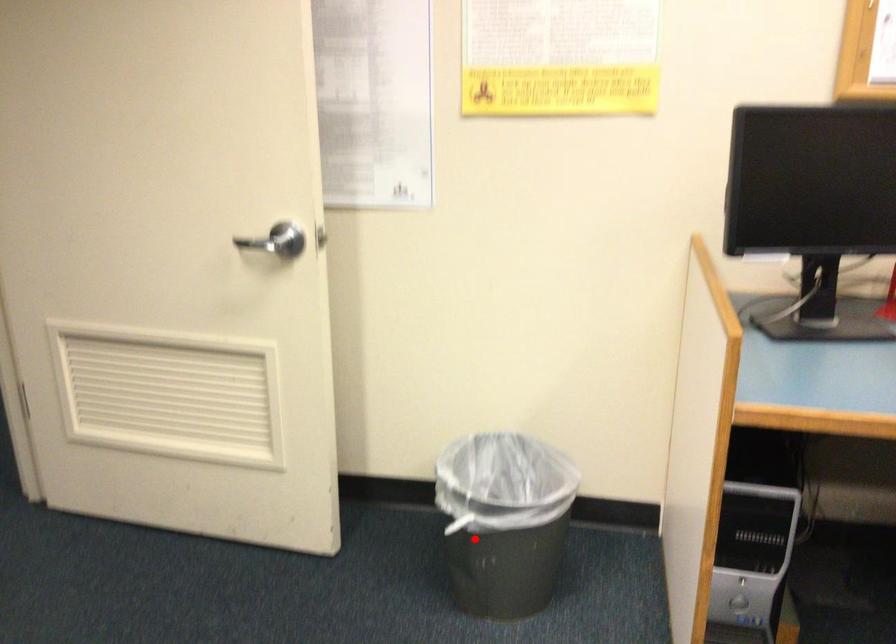
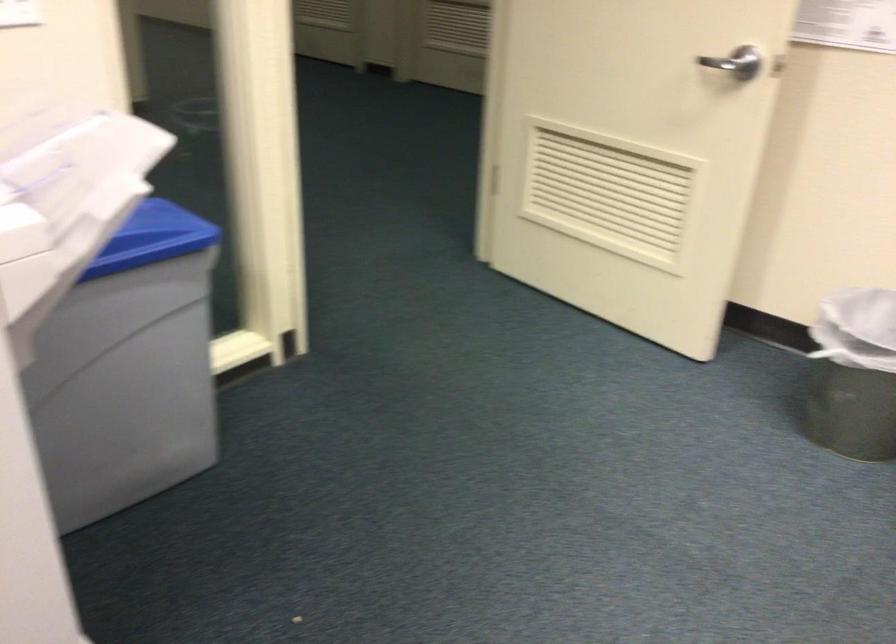
Find the pixel in the second image that matches the highlighted location in the first image.

(854, 375)